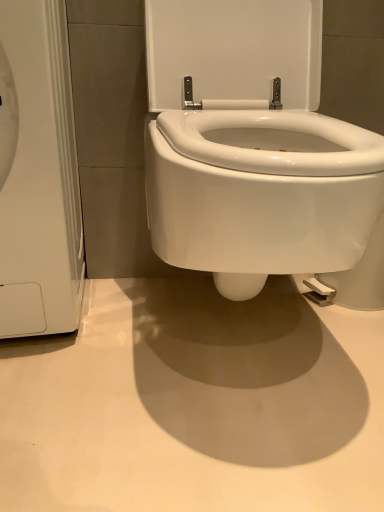
At what (x,y) coordinates should I click in order to perform the action: click on white glossy water cooler at left. Please return your answer as a coordinate pair (x, y). This screenshot has width=384, height=512. Looking at the image, I should click on (38, 174).

This screenshot has width=384, height=512. What do you see at coordinates (38, 174) in the screenshot?
I see `white glossy water cooler at left` at bounding box center [38, 174].

Find the location of a particular element. white glossy water cooler at left is located at coordinates (38, 174).